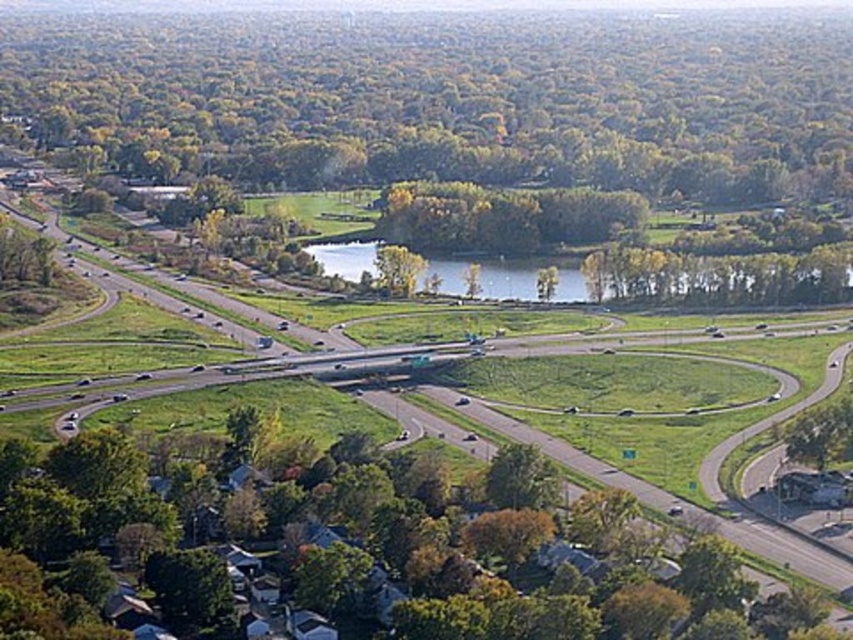
You are a drone operator flying over the highway interchange. Your task is to capture a photo of both the green leafy tree at lower center and the green grassy lake at center. Which object should you adjust your drone to focus on first to ensure both are in frame?

You should focus on the green leafy tree at lower center first because it is closer to the viewer than the green grassy lake at center, so adjusting the focus starting from the closer object ensures both are in frame.

You are a drone operator tasked with capturing aerial shots of the highway interchange. Your drone has a maximum flight range of 300 meters. If you are currently positioned at the viewer location, can your drone safely reach the green leafy tree at lower center without exceeding its range?

The green leafy tree at lower center is 282.08 meters away from the viewer. Since the drone has a maximum range of 300 meters, it can safely reach the tree without exceeding its limit.

Consider the image. You are a drone operator trying to capture a photo of the green leafy tree at lower center. The drone is currently at point A, which is at coordinates [519,564]. Is the drone already positioned directly above the green leafy tree at lower center?

Yes, the green leafy tree at lower center is located at point [519,564], so the drone is already positioned directly above it.